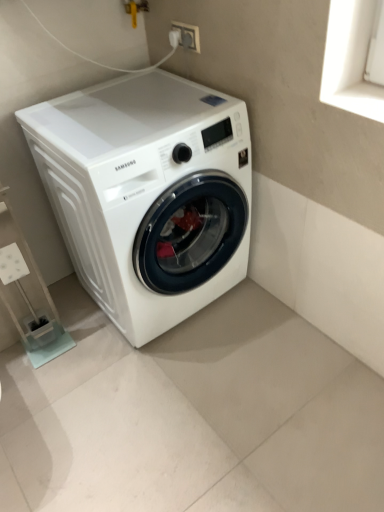
Question: From a real-world perspective, is white glossy washing machine at center under white plastic shelf at lower left?

Choices:
 (A) no
 (B) yes

Answer: (A)

Question: Is white glossy washing machine at center positioned in front of white plastic shelf at lower left?

Choices:
 (A) no
 (B) yes

Answer: (B)

Question: Does white glossy washing machine at center have a lesser height compared to white plastic shelf at lower left?

Choices:
 (A) yes
 (B) no

Answer: (B)

Question: Can you confirm if white glossy washing machine at center is bigger than white plastic shelf at lower left?

Choices:
 (A) no
 (B) yes

Answer: (B)

Question: Are white glossy washing machine at center and white plastic shelf at lower left far apart?

Choices:
 (A) no
 (B) yes

Answer: (A)

Question: Choose the correct answer: Is white plastic socket at upper center inside white glossy washing machine at center or outside it?

Choices:
 (A) inside
 (B) outside

Answer: (B)

Question: Is white plastic socket at upper center wider or thinner than white glossy washing machine at center?

Choices:
 (A) wide
 (B) thin

Answer: (B)

Question: Does point (192, 38) appear closer or farther from the camera than point (140, 262)?

Choices:
 (A) farther
 (B) closer

Answer: (A)

Question: Visually, is white plastic socket at upper center positioned to the left or to the right of white glossy washing machine at center?

Choices:
 (A) left
 (B) right

Answer: (B)

Question: Considering the positions of white glossy washing machine at center and white plastic socket at upper center in the image, is white glossy washing machine at center wider or thinner than white plastic socket at upper center?

Choices:
 (A) wide
 (B) thin

Answer: (A)

Question: Considering the positions of white glossy washing machine at center and white plastic socket at upper center in the image, is white glossy washing machine at center taller or shorter than white plastic socket at upper center?

Choices:
 (A) tall
 (B) short

Answer: (A)

Question: From the image's perspective, relative to white plastic socket at upper center, is white glossy washing machine at center above or below?

Choices:
 (A) above
 (B) below

Answer: (B)

Question: From a real-world perspective, relative to white plastic socket at upper center, is white glossy washing machine at center vertically above or below?

Choices:
 (A) below
 (B) above

Answer: (A)

Question: From a real-world perspective, relative to white plastic socket at upper center, is white plastic shelf at lower left vertically above or below?

Choices:
 (A) above
 (B) below

Answer: (B)

Question: From the image's perspective, relative to white plastic socket at upper center, is white plastic shelf at lower left above or below?

Choices:
 (A) below
 (B) above

Answer: (A)